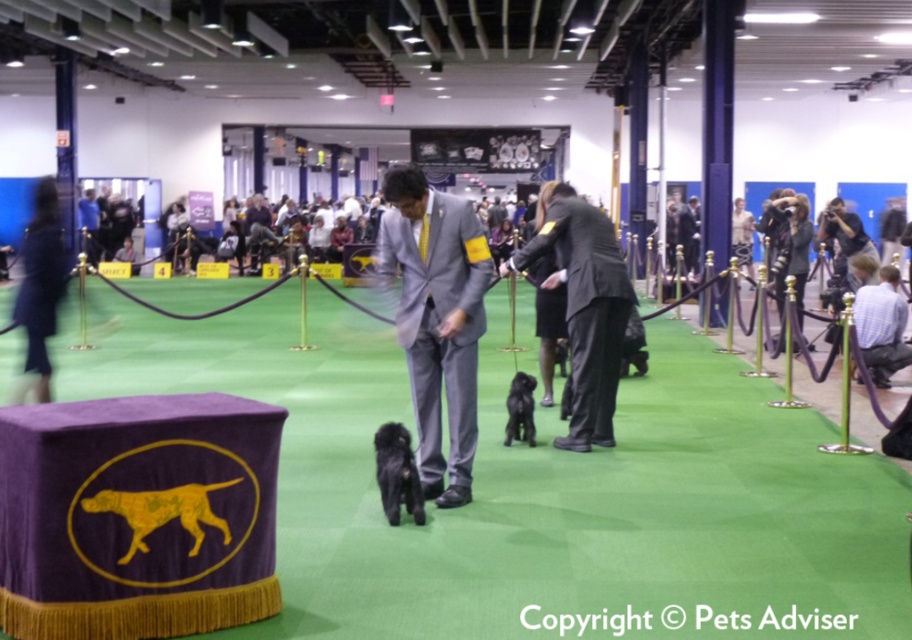
You are a photographer standing at the edge of the green carpet. You need to take a photo of the gray suit at center and the black fuzzy dog at center. Can you fit both subjects in the frame without moving either of them? The camera has a maximum field of view of 16 inches.

The distance between the gray suit at center and the black fuzzy dog at center is 16.23 inches, which exceeds the camera field of view of 16 inches. Therefore, you cannot fit both subjects in the frame without moving them.

You are a photographer positioned behind the purple table with the yellow dog silhouette. You need to capture a photo of both the gray suit at center and the black fuzzy dog at center. Which object should you frame first in your camera viewfinder to ensure both fit in the shot?

The gray suit at center is wider than the black fuzzy dog at center, so you should frame the gray suit at center first to ensure there is enough space for the black fuzzy dog at center in the shot.

You are a photographer positioned at the back of the dog show venue. You need to capture a photo of the gray suit at center and the black silky dog at center. Based on their positions, which one should you adjust your camera focus to first to ensure both are in frame?

The gray suit at center is to the left of the black silky dog at center, so you should focus on the black silky dog at center first as it is closer to the right side, ensuring both fit within the frame.